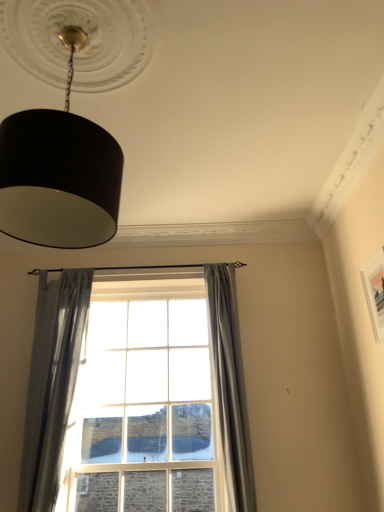
Question: Could you tell me if black matte lampshade at upper left is turned towards gray sheer curtain at left, the 1th curtain positioned from the left?

Choices:
 (A) no
 (B) yes

Answer: (A)

Question: Does black matte lampshade at upper left appear on the left side of gray sheer curtain at left, the 1th curtain positioned from the left?

Choices:
 (A) no
 (B) yes

Answer: (A)

Question: From a real-world perspective, is black matte lampshade at upper left over gray sheer curtain at left, the 1th curtain positioned from the left?

Choices:
 (A) no
 (B) yes

Answer: (B)

Question: Is black matte lampshade at upper left thinner than gray sheer curtain at left, the 1th curtain positioned from the left?

Choices:
 (A) yes
 (B) no

Answer: (B)

Question: From a real-world perspective, is black matte lampshade at upper left beneath gray sheer curtain at left, the 1th curtain positioned from the left?

Choices:
 (A) yes
 (B) no

Answer: (B)

Question: Looking at their shapes, would you say gray sheer curtain at left, which ranks as the 2th curtain in right-to-left order, is wider or thinner than gray fabric curtain at center, placed as the first curtain when sorted from right to left?

Choices:
 (A) thin
 (B) wide

Answer: (A)

Question: Is point (54, 477) closer or farther from the camera than point (210, 343)?

Choices:
 (A) closer
 (B) farther

Answer: (A)

Question: From the image's perspective, is gray sheer curtain at left, which ranks as the 2th curtain in right-to-left order, located above or below gray fabric curtain at center, placed as the first curtain when sorted from right to left?

Choices:
 (A) above
 (B) below

Answer: (B)

Question: Is gray sheer curtain at left, which ranks as the 2th curtain in right-to-left order, taller or shorter than gray fabric curtain at center, placed as the first curtain when sorted from right to left?

Choices:
 (A) short
 (B) tall

Answer: (A)

Question: Is gray sheer curtain at left, which ranks as the 2th curtain in right-to-left order, taller or shorter than black matte lampshade at upper left?

Choices:
 (A) tall
 (B) short

Answer: (A)

Question: Is point (91, 273) positioned closer to the camera than point (91, 183)?

Choices:
 (A) closer
 (B) farther

Answer: (B)

Question: In the image, is gray sheer curtain at left, which ranks as the 2th curtain in right-to-left order, positioned in front of or behind black matte lampshade at upper left?

Choices:
 (A) front
 (B) behind

Answer: (B)

Question: Would you say gray sheer curtain at left, the 1th curtain positioned from the left, is inside or outside black matte lampshade at upper left?

Choices:
 (A) outside
 (B) inside

Answer: (A)

Question: In terms of width, does gray sheer curtain at left, the 1th curtain positioned from the left, look wider or thinner when compared to clear glass window at center?

Choices:
 (A) wide
 (B) thin

Answer: (A)

Question: Is gray sheer curtain at left, the 1th curtain positioned from the left, to the left or to the right of clear glass window at center in the image?

Choices:
 (A) right
 (B) left

Answer: (B)